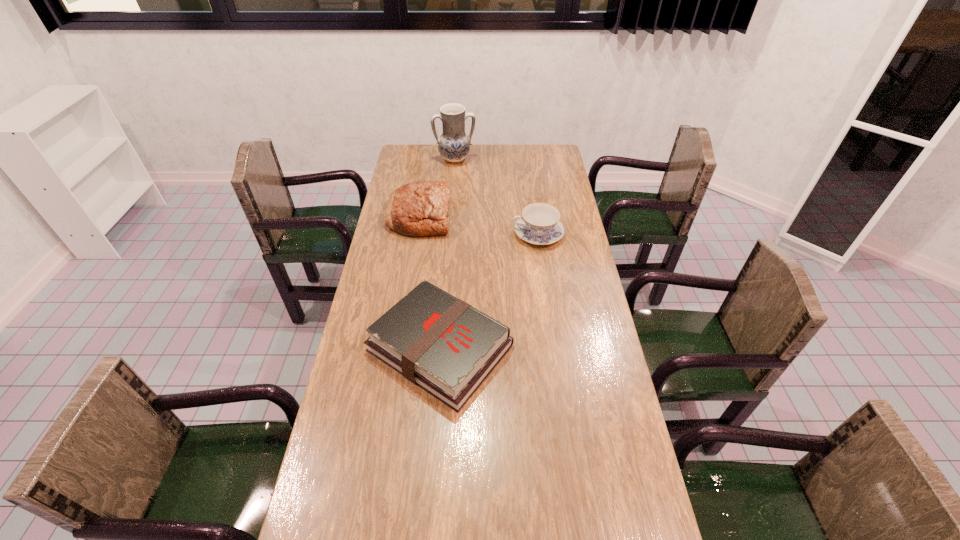
Locate an element on the screen. vacant region between the hardback book and the chinaware is located at coordinates (489, 291).

Identify the location of unoccupied area between the pottery and the rightmost object. The height and width of the screenshot is (540, 960). tap(496, 197).

At what (x,y) coordinates should I click in order to perform the action: click on free space between the chinaware and the second tallest object. Please return your answer as a coordinate pair (x, y). The height and width of the screenshot is (540, 960). Looking at the image, I should click on (479, 225).

What are the coordinates of `empty space that is in between the nearest object and the farthest object` in the screenshot? It's located at pos(447,254).

The image size is (960, 540). Identify the location of free space between the nearest object and the pottery. (447, 254).

You are a GUI agent. You are given a task and a screenshot of the screen. Output one action in this format:
    pyautogui.click(x=<x>, y=<y>)
    Task: Click on the object that stands as the second closest to the rightmost object
    This screenshot has height=540, width=960.
    Given the screenshot: What is the action you would take?
    pyautogui.click(x=421, y=208)

This screenshot has width=960, height=540. In order to click on object that is the third nearest to the rightmost object in this screenshot , I will do `click(454, 145)`.

Locate an element on the screen. free space that satisfies the following two spatial constraints: 1. on the back side of the nearest object; 2. at the sliced front of the third shortest object is located at coordinates (450, 217).

The height and width of the screenshot is (540, 960). I want to click on vacant space that satisfies the following two spatial constraints: 1. with the handle on the side of the chinaware; 2. on the front side of the tallest object, so click(x=527, y=160).

Where is `vacant space that satisfies the following two spatial constraints: 1. at the sliced front of the hardback book; 2. on the left side of the third shortest object`? The height and width of the screenshot is (540, 960). vacant space that satisfies the following two spatial constraints: 1. at the sliced front of the hardback book; 2. on the left side of the third shortest object is located at coordinates (398, 348).